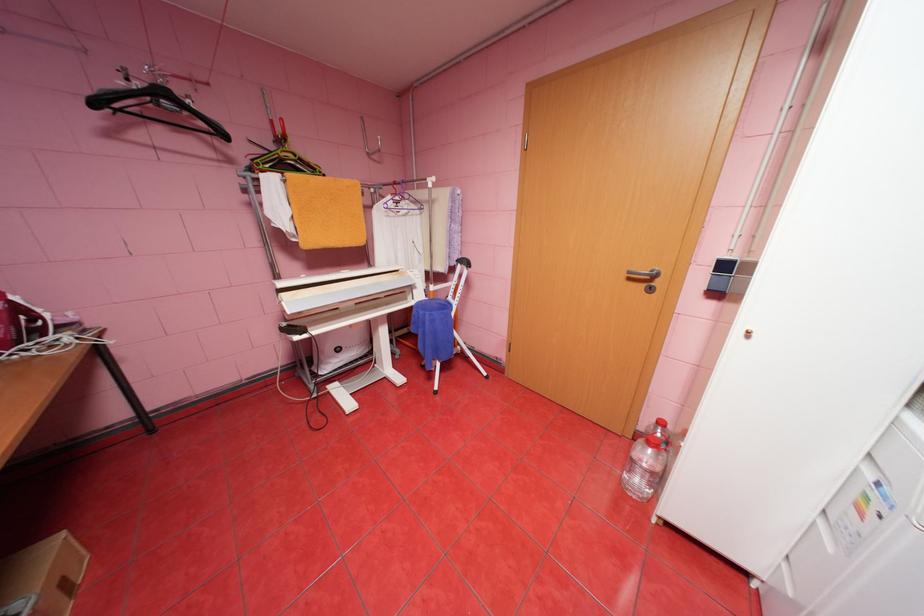
At what (x,y) coordinates should I click in order to perform the action: click on black light switch. Please return your answer as a coordinate pair (x, y). Image resolution: width=924 pixels, height=616 pixels. Looking at the image, I should click on (722, 275).